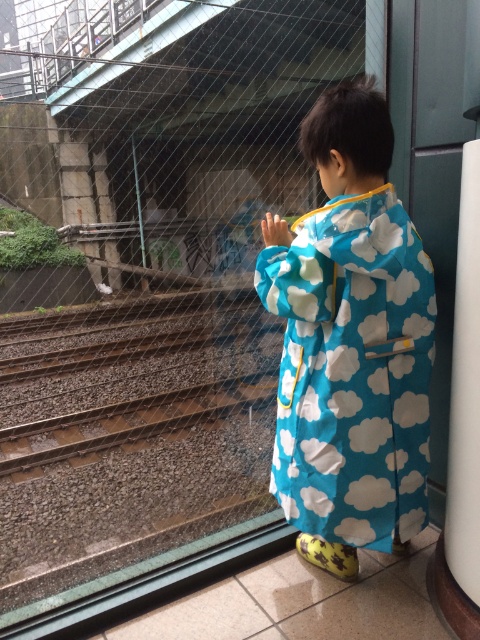
You are a delivery robot with a box that is 10 inches wide. You need to pass between the blue fabric raincoat at center and the white smooth pillar at right. Can you fit through the space between them?

The blue fabric raincoat at center is 9.52 inches from the white smooth pillar at right. Since the distance between them is less than the 10 inch width of your box, you cannot fit through the space between them.

The child is standing indoors wearing a blue fabric raincoat at center. The raincoat is positioned at coordinates 0.537 on the x and 0.731 on the y. Can you confirm if the raincoat is closer to the bottom or the top of the image?

The blue fabric raincoat at center is located at point (350, 342). Since the y coordinate is 0.731, which is closer to 1.0, it means the raincoat is closer to the top of the image.